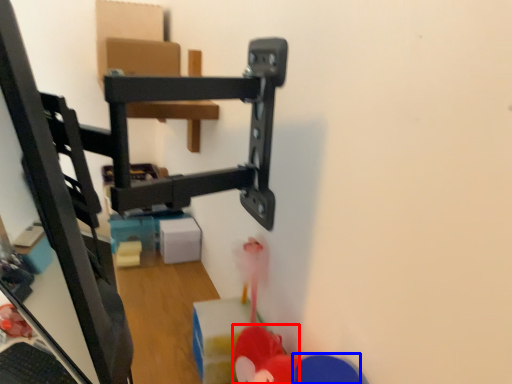
Question: Which object appears closest to the camera in this image, toy (highlighted by a red box) or toy (highlighted by a blue box)?

Choices:
 (A) toy
 (B) toy

Answer: (B)